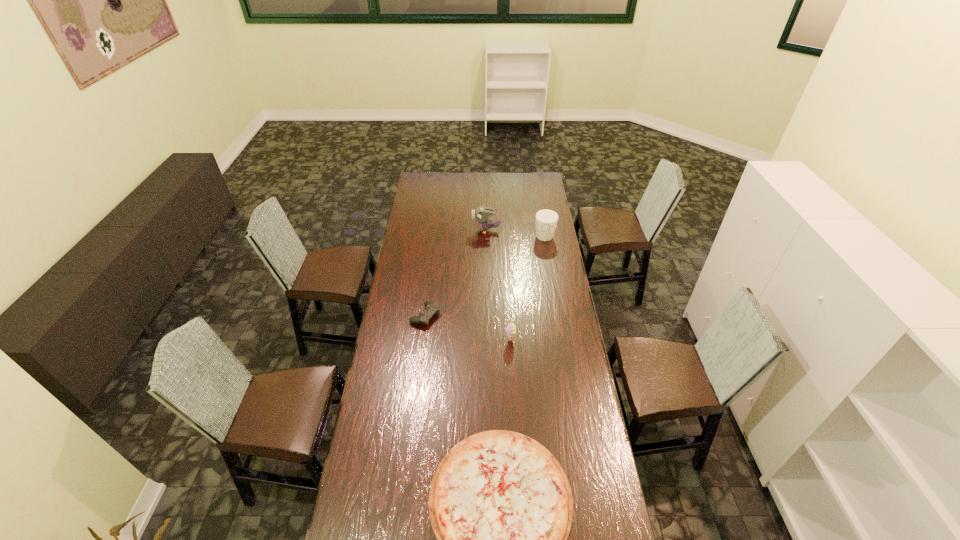
At what (x,y) coordinates should I click in order to perform the action: click on bird. Please return your answer as a coordinate pair (x, y). Image resolution: width=960 pixels, height=540 pixels. Looking at the image, I should click on (481, 214).

Where is `mug`? The height and width of the screenshot is (540, 960). mug is located at coordinates (546, 220).

The image size is (960, 540). What are the coordinates of `the fourth farthest object` in the screenshot? It's located at (x=511, y=329).

Image resolution: width=960 pixels, height=540 pixels. Find the location of `the third tallest object`. the third tallest object is located at coordinates (511, 329).

Find the location of a particular element. control is located at coordinates (431, 308).

At what (x,y) coordinates should I click in order to perform the action: click on the leftmost object. Please return your answer as a coordinate pair (x, y). Image resolution: width=960 pixels, height=540 pixels. Looking at the image, I should click on [431, 308].

I want to click on vacant position located at the beak of the bird, so click(430, 231).

Where is `free spot located 0.290m at the beak of the bird`? The height and width of the screenshot is (540, 960). free spot located 0.290m at the beak of the bird is located at coordinates (421, 231).

Image resolution: width=960 pixels, height=540 pixels. I want to click on vacant space located 0.210m at the beak of the bird, so click(x=435, y=231).

Find the location of `free spot located 0.380m on the side of the mug with the handle`. free spot located 0.380m on the side of the mug with the handle is located at coordinates (554, 292).